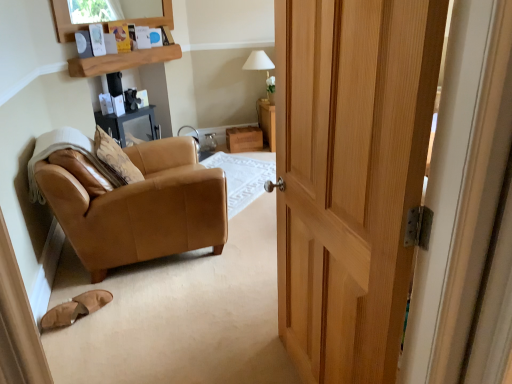
In order to click on tan leather chair at left in this screenshot , I will do `click(142, 208)`.

Locate an element on the screen. The height and width of the screenshot is (384, 512). wooden shelf at upper center is located at coordinates (122, 61).

What do you see at coordinates (122, 61) in the screenshot? This screenshot has width=512, height=384. I see `wooden shelf at upper center` at bounding box center [122, 61].

Identify the location of tan suede slippers at lower left. (75, 308).

In the image, is tan leather chair at left on the left side or the right side of wooden drawer at center?

tan leather chair at left is to the left of wooden drawer at center.

Is wooden drawer at center a part of tan leather chair at left?

Actually, wooden drawer at center is outside tan leather chair at left.

How far apart are tan leather chair at left and wooden drawer at center?

A distance of 7.05 feet exists between tan leather chair at left and wooden drawer at center.

Based on the photo, which of these two, tan leather chair at left or wooden drawer at center, is bigger?

tan leather chair at left.

Is tan suede slippers at lower left turned away from wooden drawer at center?

No.

This screenshot has width=512, height=384. What are the coordinates of `footwear lying on the left of wooden drawer at center` in the screenshot? It's located at (75, 308).

Does point (54, 310) appear closer or farther from the camera than point (257, 139)?

Point (54, 310) appears to be closer to the viewer than point (257, 139).

From the image's perspective, which object appears higher, tan suede slippers at lower left or wooden drawer at center?

wooden drawer at center.

Are tan suede slippers at lower left and white fabric lampshade at upper center beside each other?

No, tan suede slippers at lower left is not with white fabric lampshade at upper center.

Can you confirm if tan suede slippers at lower left is shorter than white fabric lampshade at upper center?

Yes, tan suede slippers at lower left is shorter than white fabric lampshade at upper center.

Is tan suede slippers at lower left bigger than white fabric lampshade at upper center?

Incorrect, tan suede slippers at lower left is not larger than white fabric lampshade at upper center.

Based on their positions, is tan suede slippers at lower left located to the left or right of white fabric lampshade at upper center?

From the image, it's evident that tan suede slippers at lower left is to the left of white fabric lampshade at upper center.

Which object is further away from the camera, wooden shelf at upper center or wooden drawer at center?

wooden drawer at center is further away from the camera.

Is wooden shelf at upper center bigger than wooden drawer at center?

Incorrect, wooden shelf at upper center is not larger than wooden drawer at center.

From a real-world perspective, which object rests below the other?

In real-world perspective, wooden drawer at center is lower.

Identify the location of shelf that appears behind the tan suede slippers at lower left. (122, 61).

Does tan suede slippers at lower left have a smaller size compared to wooden shelf at upper center?

Correct, tan suede slippers at lower left occupies less space than wooden shelf at upper center.

Measure the distance from tan suede slippers at lower left to wooden shelf at upper center.

The distance of tan suede slippers at lower left from wooden shelf at upper center is 2.00 meters.

Would you consider tan suede slippers at lower left to be distant from wooden shelf at upper center?

That's right, there is a large distance between tan suede slippers at lower left and wooden shelf at upper center.

What's the angular difference between tan leather chair at left and white fabric lampshade at upper center's facing directions?

The facing directions of tan leather chair at left and white fabric lampshade at upper center are 95.3 degrees apart.

Does point (84, 239) come in front of point (255, 65)?

Yes, point (84, 239) is closer to viewer.

Can you confirm if tan leather chair at left is positioned to the right of white fabric lampshade at upper center?

No, tan leather chair at left is not to the right of white fabric lampshade at upper center.

Are tan leather chair at left and white fabric lampshade at upper center beside each other?

No, tan leather chair at left is not touching white fabric lampshade at upper center.

Considering the sizes of objects wooden drawer at center and wooden shelf at upper center in the image provided, who is shorter, wooden drawer at center or wooden shelf at upper center?

wooden shelf at upper center is shorter.

Is wooden drawer at center in contact with wooden shelf at upper center?

wooden drawer at center and wooden shelf at upper center are clearly separated.

What are the coordinates of `drawer lying on the right of wooden shelf at upper center` in the screenshot? It's located at (244, 139).

Is wooden drawer at center not within wooden shelf at upper center?

Yes.

Locate an element on the screen. chair located in front of the wooden drawer at center is located at coordinates (142, 208).

Find the location of `drawer above the tan suede slippers at lower left (from the image's perspective)`. drawer above the tan suede slippers at lower left (from the image's perspective) is located at coordinates (244, 139).

Which object lies nearer to the anchor point wooden shelf at upper center, white fabric lampshade at upper center or tan leather chair at left?

Among the two, white fabric lampshade at upper center is located nearer to wooden shelf at upper center.

Looking at the image, which one is located further to tan leather chair at left, wooden shelf at upper center or wooden drawer at center?

wooden drawer at center is further to tan leather chair at left.

Based on their spatial positions, is wooden shelf at upper center or tan suede slippers at lower left closer to tan leather chair at left?

tan suede slippers at lower left lies closer to tan leather chair at left than the other object.

From the image, which object appears to be nearer to wooden drawer at center, white fabric lampshade at upper center or wooden shelf at upper center?

The object closer to wooden drawer at center is white fabric lampshade at upper center.

Estimate the real-world distances between objects in this image. Which object is further from tan suede slippers at lower left, white fabric lampshade at upper center or tan leather chair at left?

white fabric lampshade at upper center is positioned further to the anchor tan suede slippers at lower left.

Estimate the real-world distances between objects in this image. Which object is closer to tan leather chair at left, wooden drawer at center or wooden shelf at upper center?

wooden shelf at upper center is positioned closer to the anchor tan leather chair at left.

Considering their positions, is wooden shelf at upper center positioned closer to white fabric lampshade at upper center than tan leather chair at left?

wooden shelf at upper center.

Looking at the image, which one is located closer to tan suede slippers at lower left, wooden shelf at upper center or wooden drawer at center?

wooden shelf at upper center is positioned closer to the anchor tan suede slippers at lower left.

This screenshot has width=512, height=384. What are the coordinates of `lamp located between tan suede slippers at lower left and wooden drawer at center in the depth direction` in the screenshot? It's located at (258, 62).

In order to click on chair between tan suede slippers at lower left and white fabric lampshade at upper center from front to back in this screenshot , I will do `click(142, 208)`.

What are the coordinates of `lamp between wooden shelf at upper center and wooden drawer at center in the front-back direction` in the screenshot? It's located at (258, 62).

The width and height of the screenshot is (512, 384). Find the location of `chair between tan suede slippers at lower left and wooden drawer at center from front to back`. chair between tan suede slippers at lower left and wooden drawer at center from front to back is located at coordinates (142, 208).